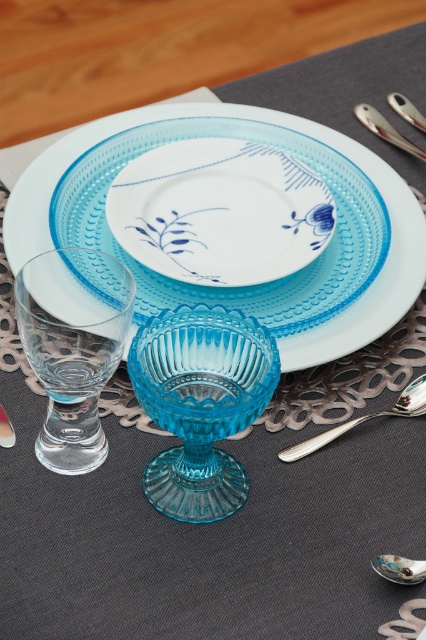
Between blue porcelain plate at center and silver metallic spoon at lower right, which one has more height?

blue porcelain plate at center

Find the location of a particular element. The image size is (426, 640). blue porcelain plate at center is located at coordinates (219, 211).

Can you confirm if transparent glass wine glass at lower left is positioned above silver metallic spoon at lower right?

Correct, transparent glass wine glass at lower left is located above silver metallic spoon at lower right.

Does transparent glass wine glass at lower left appear under silver metallic spoon at lower right?

No, transparent glass wine glass at lower left is not below silver metallic spoon at lower right.

Who is more forward, [54,301] or [328,429]?

Point [328,429] is more forward.

You are a GUI agent. You are given a task and a screenshot of the screen. Output one action in this format:
    pyautogui.click(x=<x>, y=<y>)
    Task: Click on the transparent glass wine glass at lower left
    The image size is (426, 640).
    Given the screenshot: What is the action you would take?
    pyautogui.click(x=72, y=346)

Who is more distant from viewer, [132,372] or [386,570]?

The point [386,570] is behind.

This screenshot has height=640, width=426. Find the location of `transparent glass bowl at center`. transparent glass bowl at center is located at coordinates (201, 403).

The width and height of the screenshot is (426, 640). Find the location of `transparent glass bowl at center`. transparent glass bowl at center is located at coordinates (201, 403).